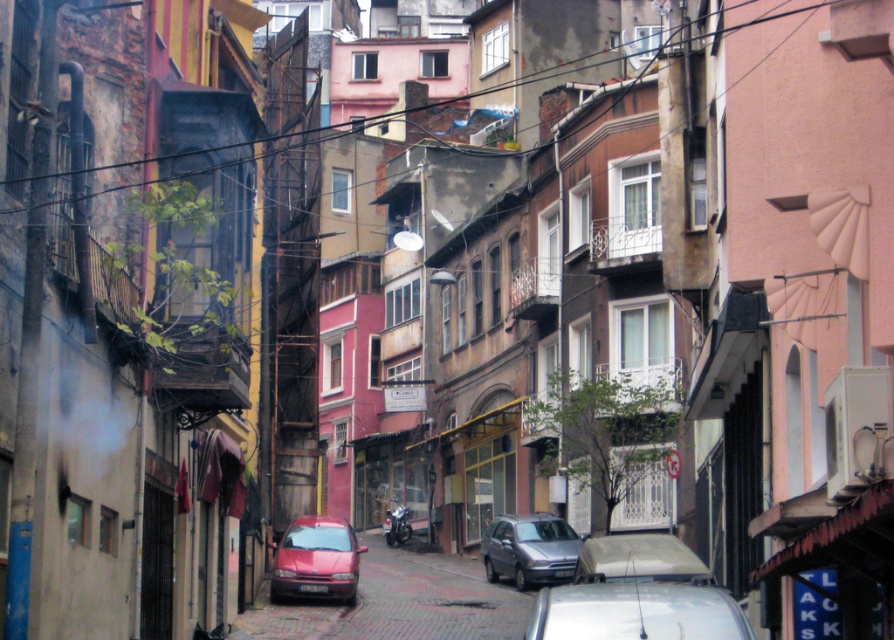
You are a pedestrian standing on the sidewalk and want to cross the street to reach the other side. There are two cars parked at the center of the street, a metallic red car at center and a metallic silver car at center. Which car should you walk around to cross safely?

You should walk around the metallic silver car at center because the metallic red car at center is to the left of it, so the silver car is on the right side of the street, making it safer to cross there.

You are standing on the red brick street in the urban scene. You see two points marked on the ground. One is at coordinates point (311, 577) and the other is at point (564, 554). Which point is closer to you?

Point (311, 577) is closer to the camera than point (564, 554).